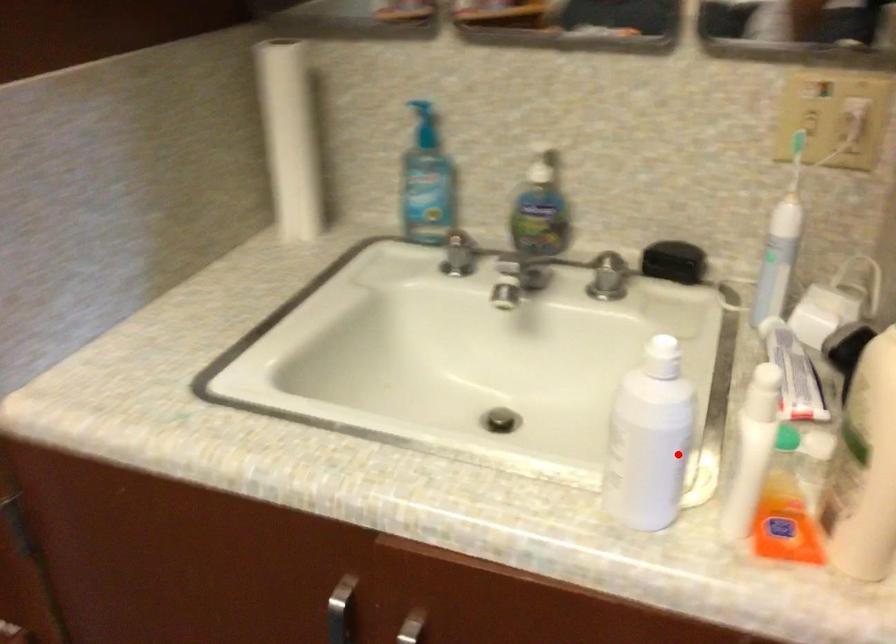
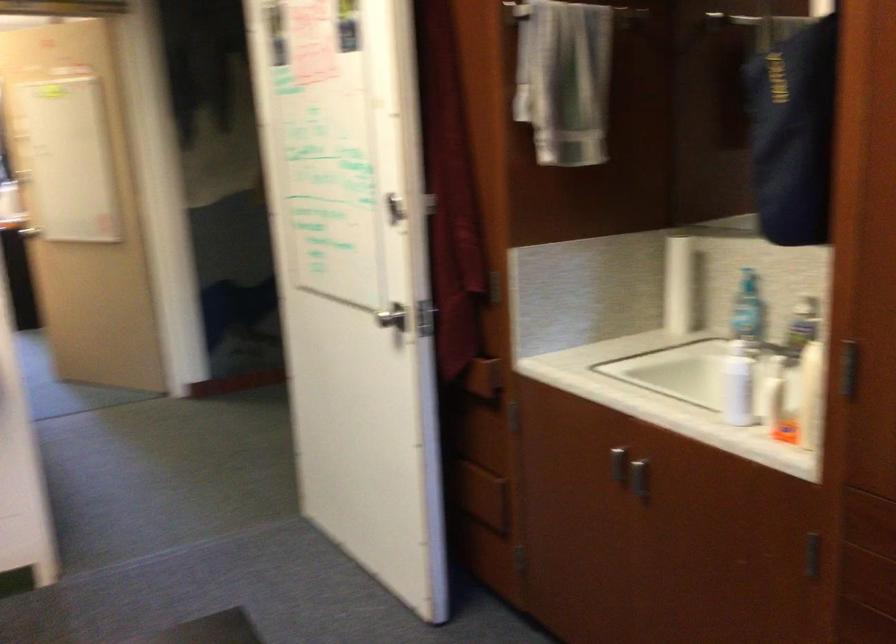
Question: I am providing you with two images of the same scene from different viewpoints. Image1 has a red point marked. In image2, the corresponding 3D location appears at what relative position? Reply with the corresponding letter.

Choices:
 (A) Closer
 (B) Farther

Answer: (B)